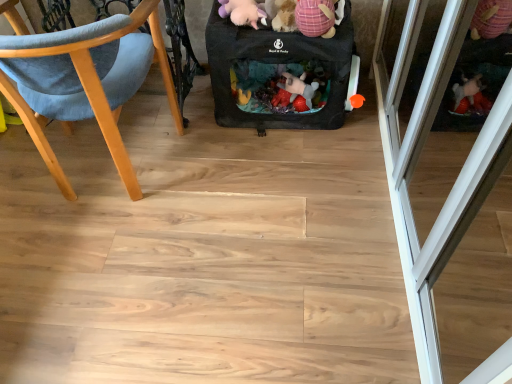
At what (x,y) coordinates should I click in order to perform the action: click on free spot in front of black fabric baby carriage at center. Please return your answer as a coordinate pair (x, y). Looking at the image, I should click on (284, 170).